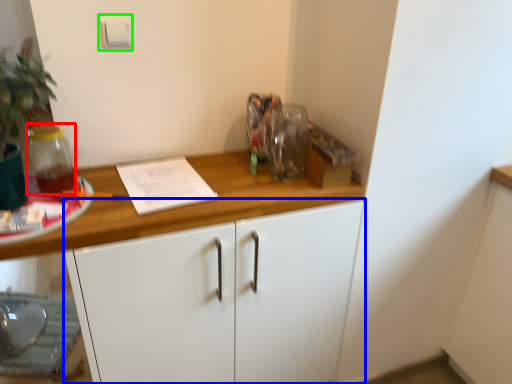
Question: Which object is the closest to the glass jar (highlighted by a red box)? Choose among these: cabinetry (highlighted by a blue box) or light switch (highlighted by a green box).

Choices:
 (A) cabinetry
 (B) light switch

Answer: (B)